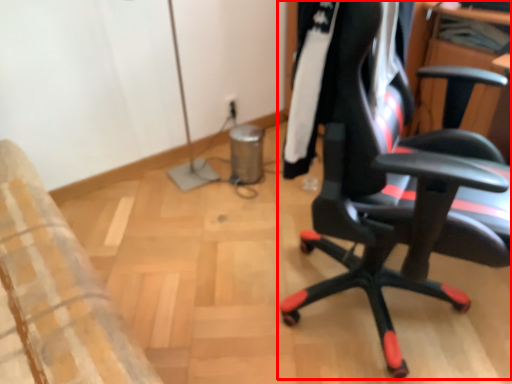
Question: In this image, where is chair (annotated by the red box) located relative to clothing?

Choices:
 (A) left
 (B) right

Answer: (B)